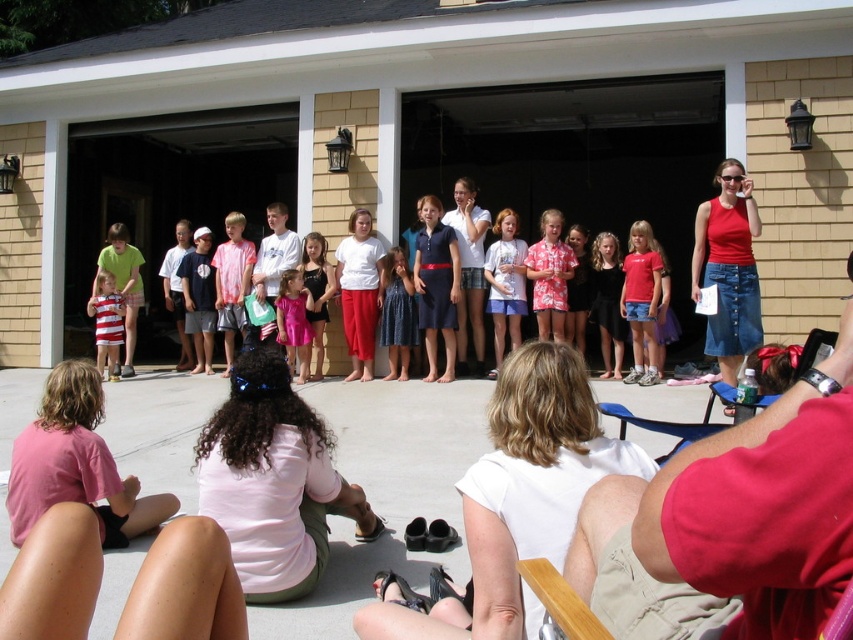
You are organizing a small outdoor event in the garage area. You need to place a 10 feet long table between the dark blue dress at center and the striped cotton dress at left. Is there enough space between them to fit the table?

The distance between the dark blue dress at center and the striped cotton dress at left is 13.82 feet. Since the table is 10 feet long, there is enough space to place it between them.